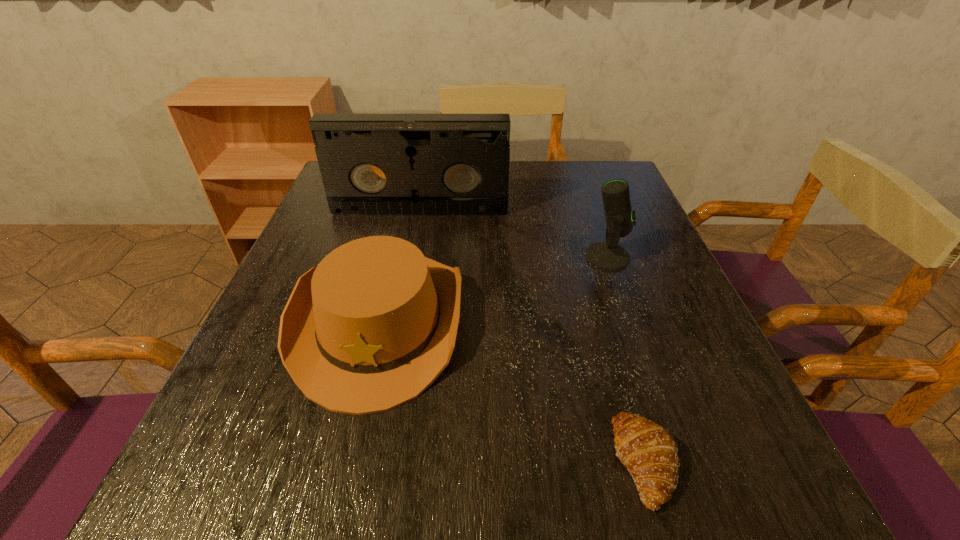
Locate an element on the screen. Image resolution: width=960 pixels, height=540 pixels. the farthest object is located at coordinates (371, 164).

At what (x,y) coordinates should I click in order to perform the action: click on the tallest object. Please return your answer as a coordinate pair (x, y). This screenshot has height=540, width=960. Looking at the image, I should click on (371, 164).

Find the location of a particular element. microphone is located at coordinates (608, 255).

Locate an element on the screen. This screenshot has width=960, height=540. the second shortest object is located at coordinates coord(371,327).

Where is `the shortest object`? Image resolution: width=960 pixels, height=540 pixels. the shortest object is located at coordinates (649, 452).

At what (x,y) coordinates should I click in order to perform the action: click on crescent roll. Please return your answer as a coordinate pair (x, y). The height and width of the screenshot is (540, 960). Looking at the image, I should click on (649, 452).

Where is `vacant space located on the front side of the tallest object`? Image resolution: width=960 pixels, height=540 pixels. vacant space located on the front side of the tallest object is located at coordinates (396, 336).

Where is `vacant position located 0.300m on the front of the second tallest object`? Image resolution: width=960 pixels, height=540 pixels. vacant position located 0.300m on the front of the second tallest object is located at coordinates (654, 389).

The width and height of the screenshot is (960, 540). I want to click on free point located 0.140m on the front-facing side of the second shortest object, so click(x=335, y=510).

Find the location of `vacant space situated 0.300m on the back of the nearest object`. vacant space situated 0.300m on the back of the nearest object is located at coordinates (593, 287).